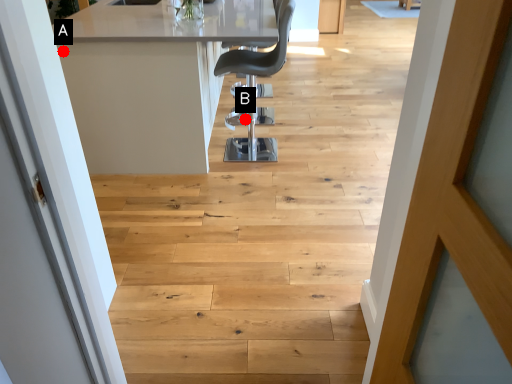
Question: Two points are circled on the image, labeled by A and B beside each circle. Which point is farther from the camera taking this photo?

Choices:
 (A) A is further
 (B) B is further

Answer: (B)